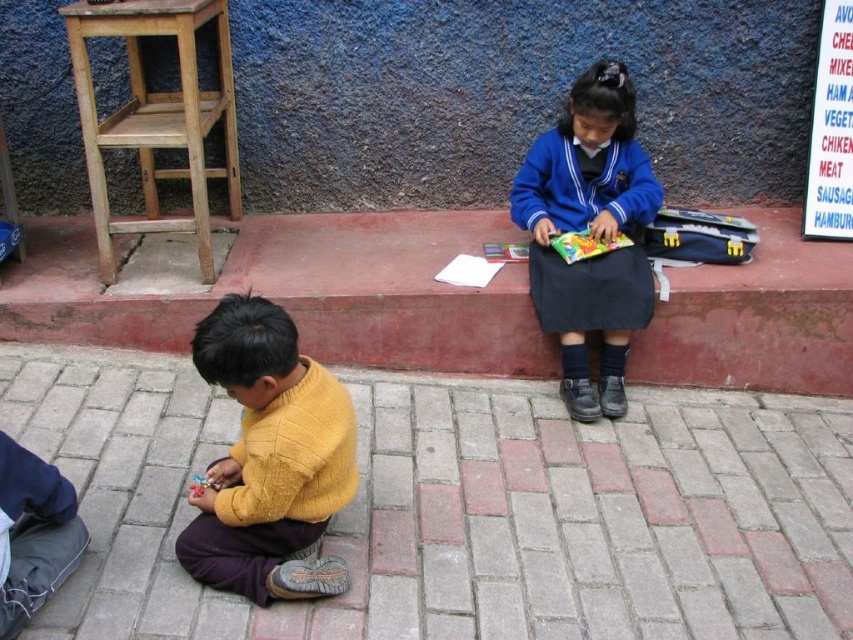
You are a delivery person needing to place a small package on the largest available surface in the scene. Which object should you choose between the brick pavement at lower center and the wooden stool at left?

The brick pavement at lower center is larger in size than the wooden stool at left, so you should choose the brick pavement at lower center to place the small package.

You are a construction worker needing to choose between the brick at lower center and the wooden stool at left for a project that requires a wider material. Which object should you select?

The brick at lower center should be selected because its width is larger than the wooden stool at left.